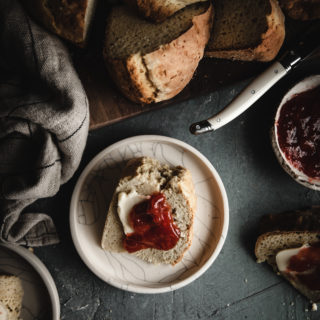
The image size is (320, 320). In order to click on towel in this screenshot , I will do `click(56, 106)`.